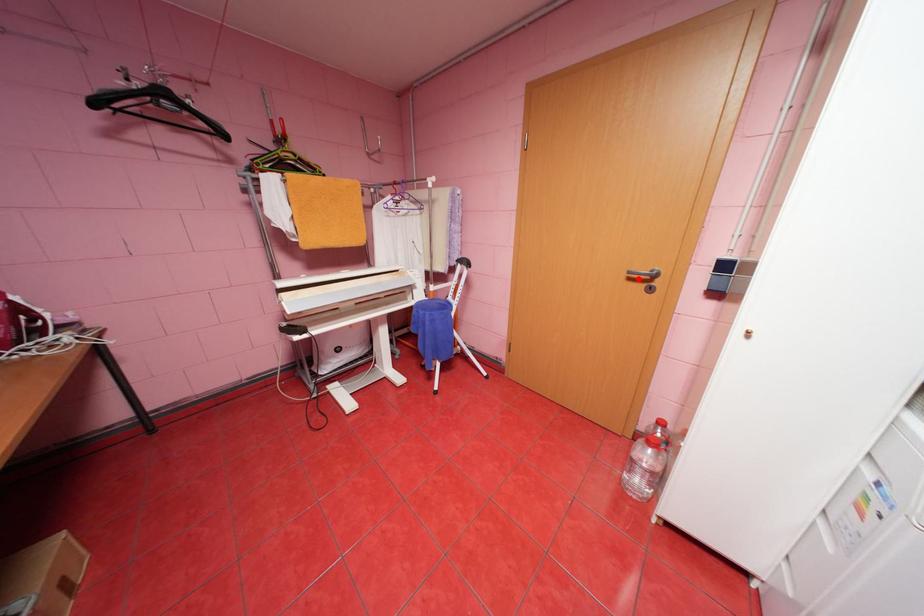
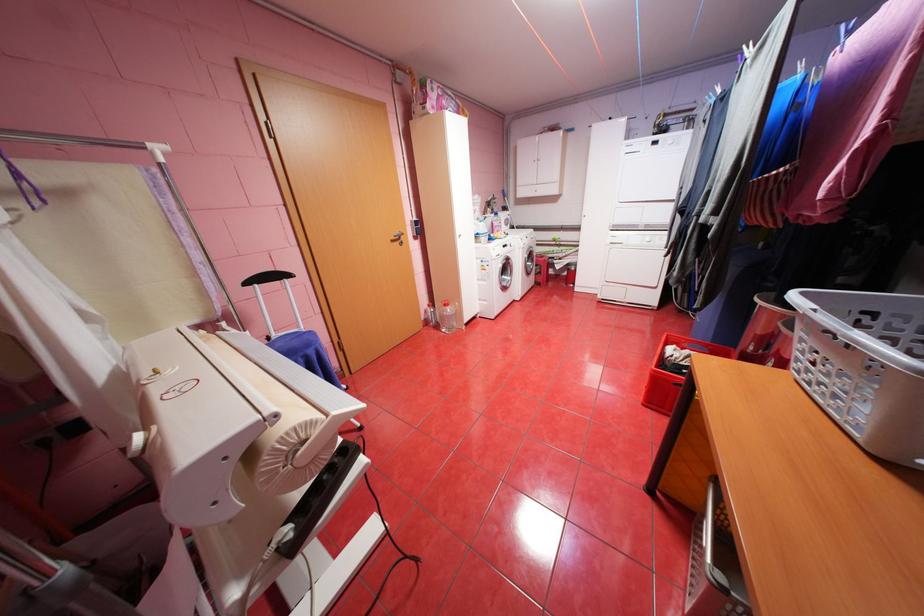
The point at the highlighted location is marked in the first image. Where is the corresponding point in the second image?

(400, 241)